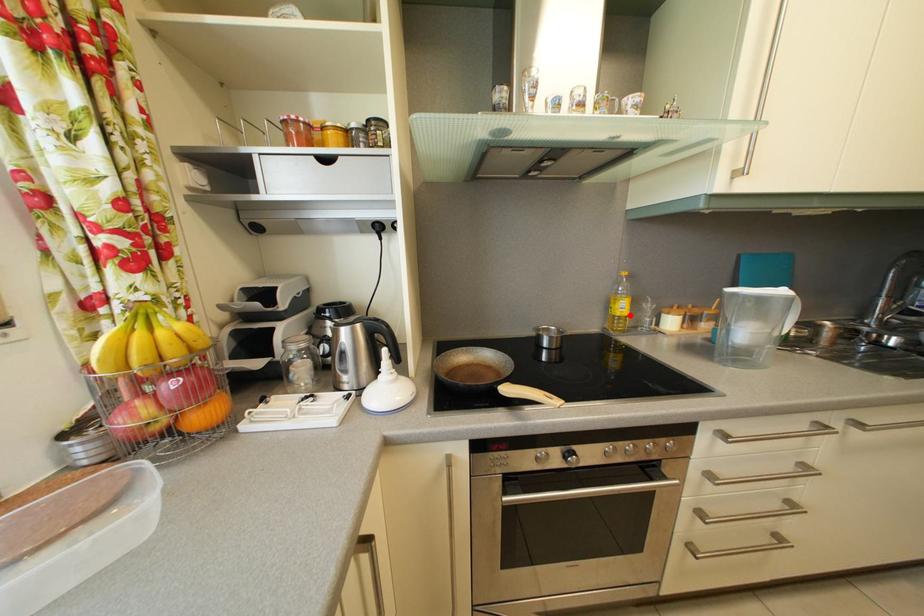
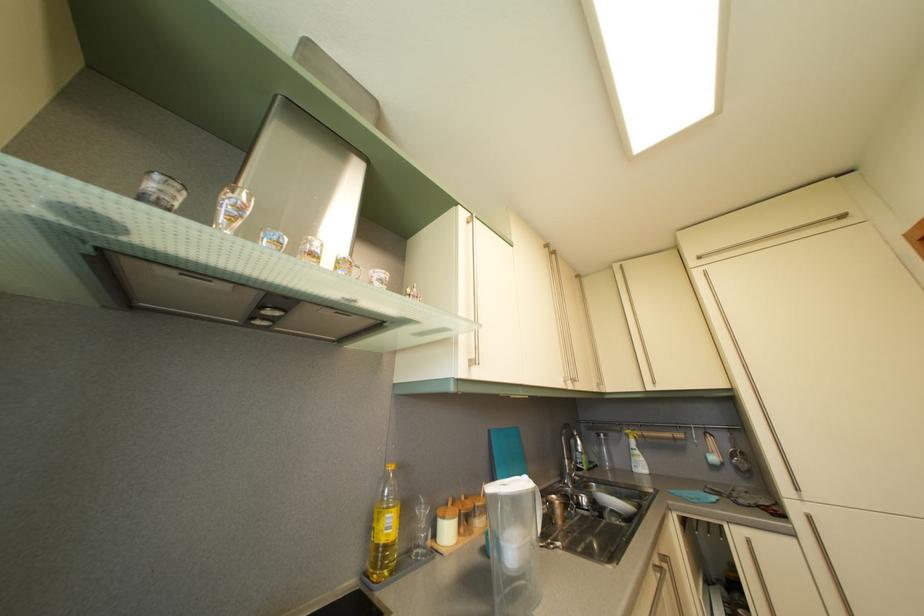
The point at the highlighted location is marked in the first image. Where is the corresponding point in the second image?

(396, 533)